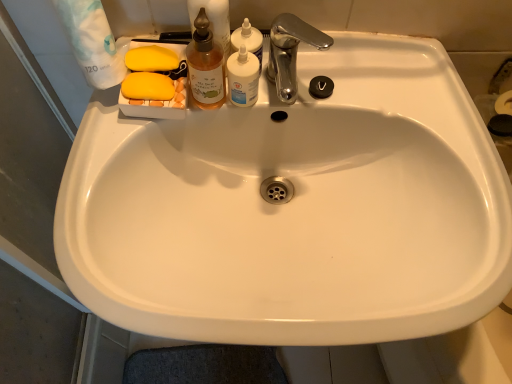
Question: From the image's perspective, does chrome metallic faucet at upper center appear higher than translucent plastic bottle at upper center, the 1th cleaning product positioned from the right?

Choices:
 (A) yes
 (B) no

Answer: (B)

Question: Is chrome metallic faucet at upper center far from translucent plastic bottle at upper center, the 1th cleaning product positioned from the right?

Choices:
 (A) yes
 (B) no

Answer: (B)

Question: Is chrome metallic faucet at upper center taller than translucent plastic bottle at upper center, the second cleaning product from the left?

Choices:
 (A) no
 (B) yes

Answer: (B)

Question: From the image's perspective, is chrome metallic faucet at upper center under translucent plastic bottle at upper center, the second cleaning product from the left?

Choices:
 (A) yes
 (B) no

Answer: (A)

Question: Can you confirm if chrome metallic faucet at upper center is bigger than translucent plastic bottle at upper center, the 1th cleaning product positioned from the right?

Choices:
 (A) yes
 (B) no

Answer: (A)

Question: Considering the positions of translucent plastic bottle at upper center, the 1th cleaning product positioned from the right, and white opaque bottle at upper center in the image, is translucent plastic bottle at upper center, the 1th cleaning product positioned from the right, taller or shorter than white opaque bottle at upper center?

Choices:
 (A) tall
 (B) short

Answer: (B)

Question: Relative to white opaque bottle at upper center, is translucent plastic bottle at upper center, the 1th cleaning product positioned from the right, in front or behind?

Choices:
 (A) behind
 (B) front

Answer: (A)

Question: Does point (246, 21) appear closer or farther from the camera than point (250, 100)?

Choices:
 (A) farther
 (B) closer

Answer: (A)

Question: Is translucent plastic bottle at upper center, the 1th cleaning product positioned from the right, situated inside white opaque bottle at upper center or outside?

Choices:
 (A) outside
 (B) inside

Answer: (A)

Question: Looking at the image, does translucent glass bottle at upper center, which appears as the 1th cleaning product when viewed from the left, seem bigger or smaller compared to white opaque bottle at upper center?

Choices:
 (A) big
 (B) small

Answer: (A)

Question: Is translucent glass bottle at upper center, which appears as the 1th cleaning product when viewed from the left, in front of or behind white opaque bottle at upper center in the image?

Choices:
 (A) behind
 (B) front

Answer: (B)

Question: In terms of width, does translucent glass bottle at upper center, which appears as the 1th cleaning product when viewed from the left, look wider or thinner when compared to white opaque bottle at upper center?

Choices:
 (A) wide
 (B) thin

Answer: (A)

Question: In terms of height, does translucent glass bottle at upper center, which appears as the 1th cleaning product when viewed from the left, look taller or shorter compared to white opaque bottle at upper center?

Choices:
 (A) short
 (B) tall

Answer: (B)

Question: Based on their positions, is translucent glass bottle at upper center, which appears as the 1th cleaning product when viewed from the left, located to the left or right of translucent plastic bottle at upper center, the 1th cleaning product positioned from the right?

Choices:
 (A) left
 (B) right

Answer: (A)

Question: Looking at their shapes, would you say translucent glass bottle at upper center, which appears as the 1th cleaning product when viewed from the left, is wider or thinner than translucent plastic bottle at upper center, the 1th cleaning product positioned from the right?

Choices:
 (A) thin
 (B) wide

Answer: (A)